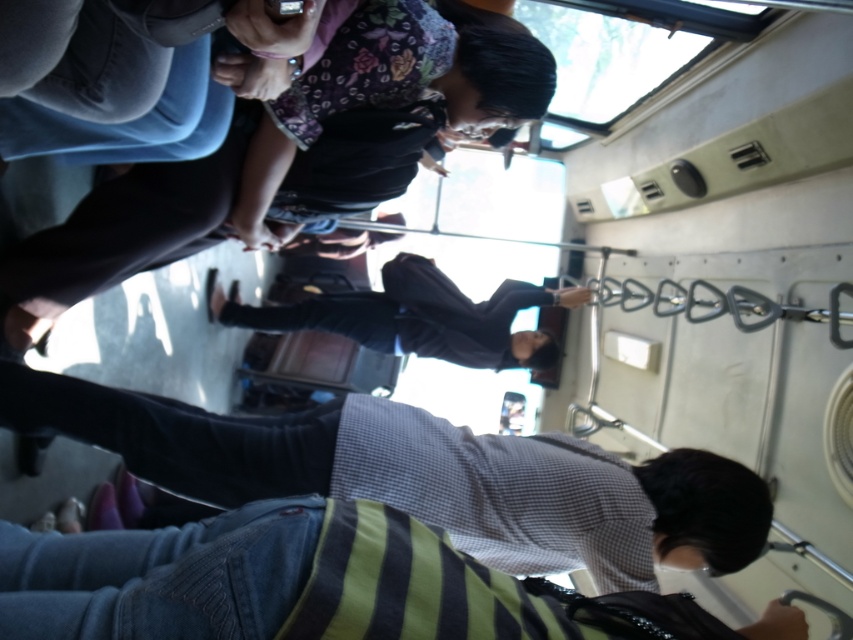
Question: Which of the following is the farthest from the observer?

Choices:
 (A) striped sweater at lower center
 (B) striped shirt at lower center

Answer: (B)

Question: Which point is closer to the camera?

Choices:
 (A) (257, 460)
 (B) (410, 304)
 (C) (320, 513)

Answer: (C)

Question: Can you confirm if striped shirt at lower center is bigger than dark blue fabric jacket at center?

Choices:
 (A) no
 (B) yes

Answer: (A)

Question: Is striped shirt at lower center thinner than dark blue fabric jacket at center?

Choices:
 (A) no
 (B) yes

Answer: (B)

Question: Which of these objects is positioned closest to the striped sweater at lower center?

Choices:
 (A) striped shirt at lower center
 (B) dark blue fabric jacket at center

Answer: (A)

Question: Considering the relative positions of striped shirt at lower center and striped sweater at lower center in the image provided, where is striped shirt at lower center located with respect to striped sweater at lower center?

Choices:
 (A) left
 (B) right

Answer: (B)